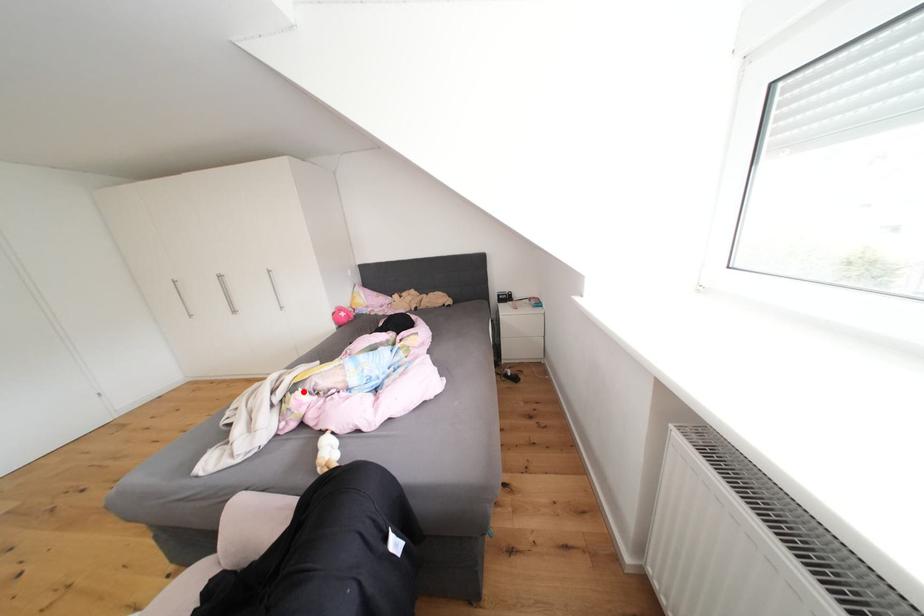
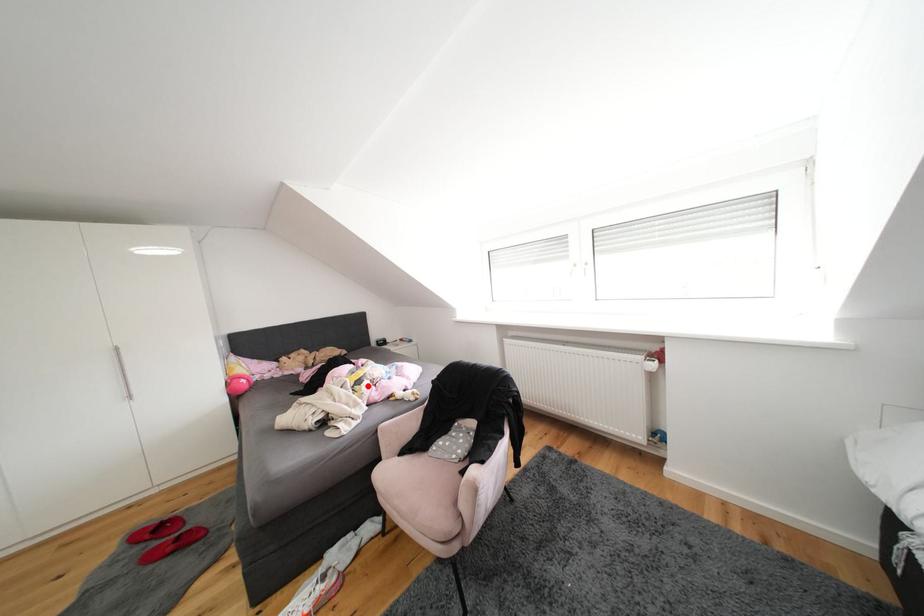
I am providing you with two images of the same scene from different viewpoints. A red point is marked on the first image and another point is marked on the second image. Does the point marked in image1 correspond to the same location as the one in image2?

Yes